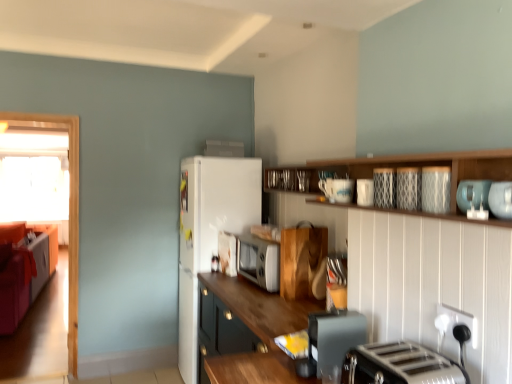
Question: Considering the relative sizes of transparent glass door at left and velvet orange couch at left in the image provided, is transparent glass door at left bigger than velvet orange couch at left?

Choices:
 (A) yes
 (B) no

Answer: (B)

Question: Is transparent glass door at left facing away from velvet orange couch at left?

Choices:
 (A) no
 (B) yes

Answer: (A)

Question: From the image's perspective, is transparent glass door at left located above velvet orange couch at left?

Choices:
 (A) yes
 (B) no

Answer: (A)

Question: From a real-world perspective, is transparent glass door at left on top of velvet orange couch at left?

Choices:
 (A) yes
 (B) no

Answer: (A)

Question: Is transparent glass door at left thinner than velvet orange couch at left?

Choices:
 (A) yes
 (B) no

Answer: (A)

Question: Is transparent glass door at left wider than velvet orange couch at left?

Choices:
 (A) no
 (B) yes

Answer: (A)

Question: Does velvet orange couch at left have a larger size compared to patterned ceramic plate at upper center, placed as the fifth appliance when sorted from back to front?

Choices:
 (A) yes
 (B) no

Answer: (A)

Question: Does velvet orange couch at left come behind patterned ceramic plate at upper center, the 3th appliance viewed from the front?

Choices:
 (A) no
 (B) yes

Answer: (B)

Question: Is velvet orange couch at left aimed at patterned ceramic plate at upper center, placed as the fifth appliance when sorted from back to front?

Choices:
 (A) no
 (B) yes

Answer: (A)

Question: Is velvet orange couch at left at the right side of patterned ceramic plate at upper center, which is the 6th appliance in bottom-to-top order?

Choices:
 (A) yes
 (B) no

Answer: (B)

Question: Are velvet orange couch at left and patterned ceramic plate at upper center, marked as the second appliance in a top-to-bottom arrangement, making contact?

Choices:
 (A) yes
 (B) no

Answer: (B)

Question: Does velvet orange couch at left have a lesser width compared to patterned ceramic plate at upper center, placed as the fifth appliance when sorted from back to front?

Choices:
 (A) no
 (B) yes

Answer: (A)

Question: From a real-world perspective, is white matte refrigerator at upper center, which appears as the 7th appliance when viewed from the front, positioned under white frosted glass window at left based on gravity?

Choices:
 (A) no
 (B) yes

Answer: (A)